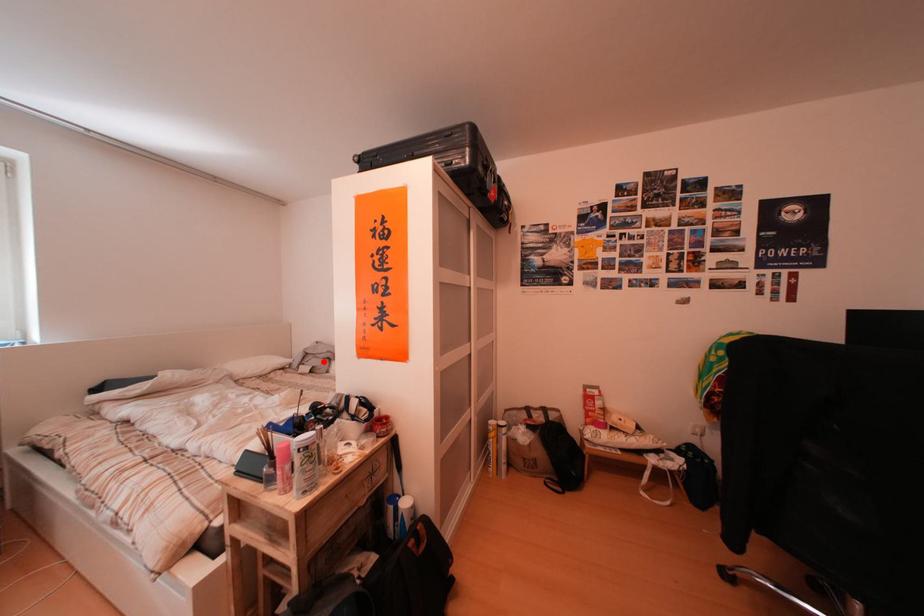
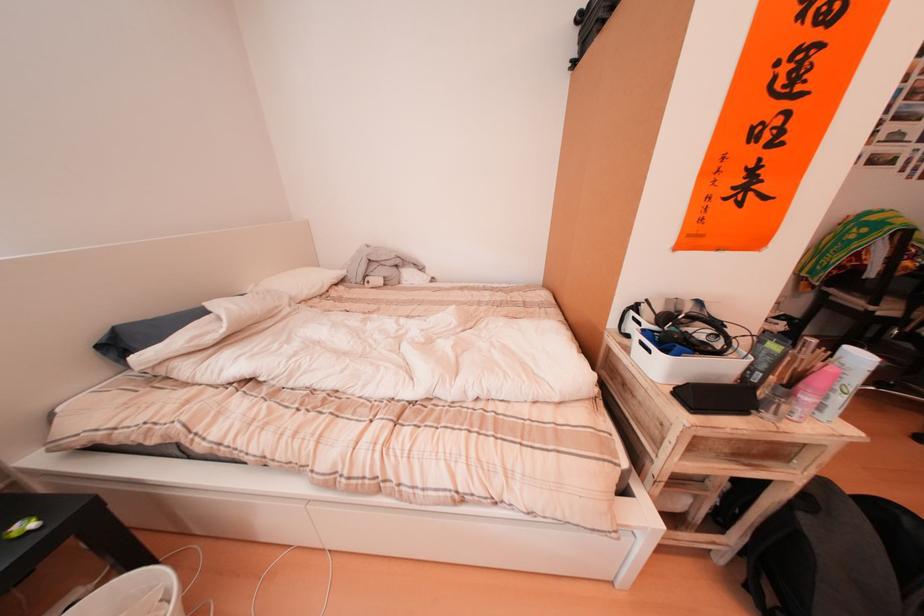
Where in the second image is the point corresponding to the highlighted location from the first image?

(390, 270)